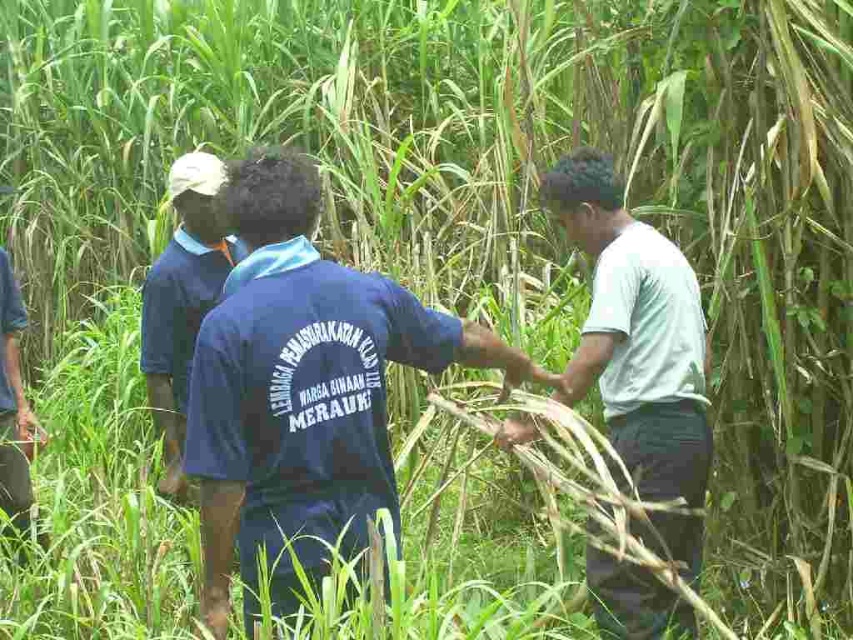
From the picture: What is the exact location of the blue fabric shirt at center in the image?

The blue fabric shirt at center is located at point (302, 388).

Based on the scene description, can you determine if the white cotton shirt at right has a larger width than the dark blue shirt at center?

The white cotton shirt at right might be wider than dark blue shirt at center according to the description.

Based on the scene description, can you determine the spatial relationship between the white cotton shirt at right and the dark blue shirt at center?

The white cotton shirt at right is to the right of the dark blue shirt at center.